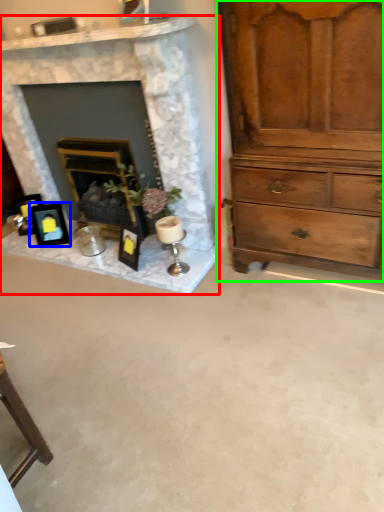
Question: Considering the real-world distances, which object is closest to fireplace (highlighted by a red box)? picture frame (highlighted by a blue box) or chest of drawers (highlighted by a green box).

Choices:
 (A) picture frame
 (B) chest of drawers

Answer: (B)